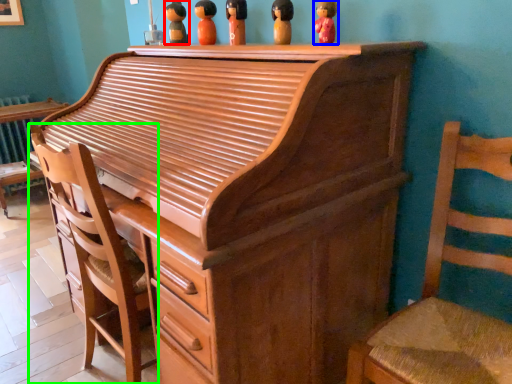
Question: Which object is the closest to the toy (highlighted by a red box)? Choose among these: toy (highlighted by a blue box) or chair (highlighted by a green box).

Choices:
 (A) toy
 (B) chair

Answer: (A)